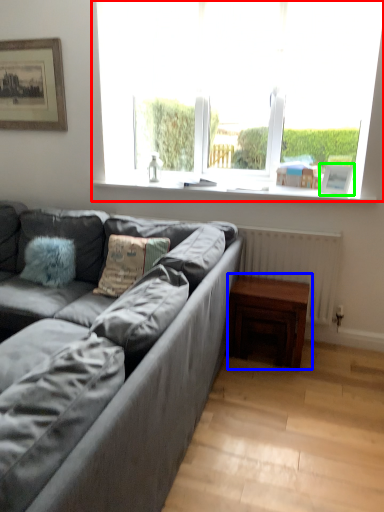
Question: Considering the real-world distances, which object is farthest from window (highlighted by a red box)? table (highlighted by a blue box) or picture frame (highlighted by a green box)?

Choices:
 (A) table
 (B) picture frame

Answer: (A)